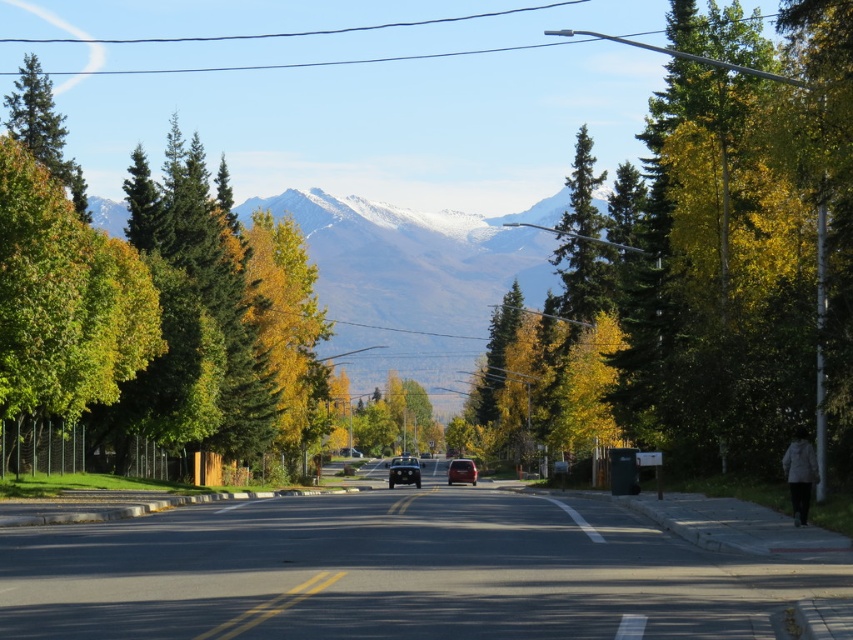
Can you confirm if green matte tree at left is shorter than yellow asphalt road at center?

Incorrect, green matte tree at left's height does not fall short of yellow asphalt road at center's.

Which is more to the right, green matte tree at left or yellow asphalt road at center?

From the viewer's perspective, yellow asphalt road at center appears more on the right side.

Does point (71, 310) lie in front of point (396, 506)?

That is False.

Where is `green matte tree at left`? The width and height of the screenshot is (853, 640). green matte tree at left is located at coordinates (64, 300).

Is yellow/golden leaves at center bigger than yellow asphalt road at center?

Correct, yellow/golden leaves at center is larger in size than yellow asphalt road at center.

Is the position of yellow/golden leaves at center less distant than that of yellow asphalt road at center?

No, yellow/golden leaves at center is behind yellow asphalt road at center.

Is point (316, 410) farther from camera compared to point (433, 486)?

That is True.

What are the coordinates of `yellow/golden leaves at center` in the screenshot? It's located at (287, 326).

Is green matte tree at left wider than metallic silver van at center?

Indeed, green matte tree at left has a greater width compared to metallic silver van at center.

Looking at this image, who is shorter, green matte tree at left or metallic silver van at center?

Standing shorter between the two is metallic silver van at center.

Between point (16, 410) and point (466, 481), which one is positioned behind?

Positioned behind is point (466, 481).

Find the location of a particular element. green matte tree at left is located at coordinates (64, 300).